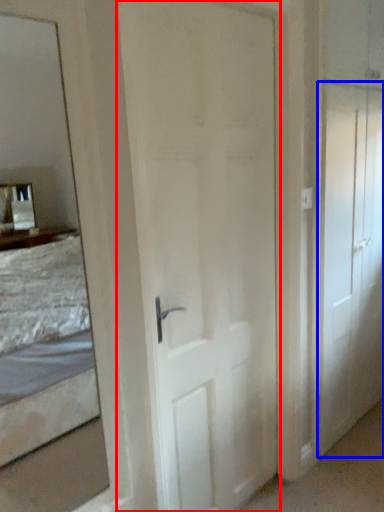
Question: Which point is closer to the camera, door (highlighted by a red box) or door (highlighted by a blue box)?

Choices:
 (A) door
 (B) door

Answer: (A)